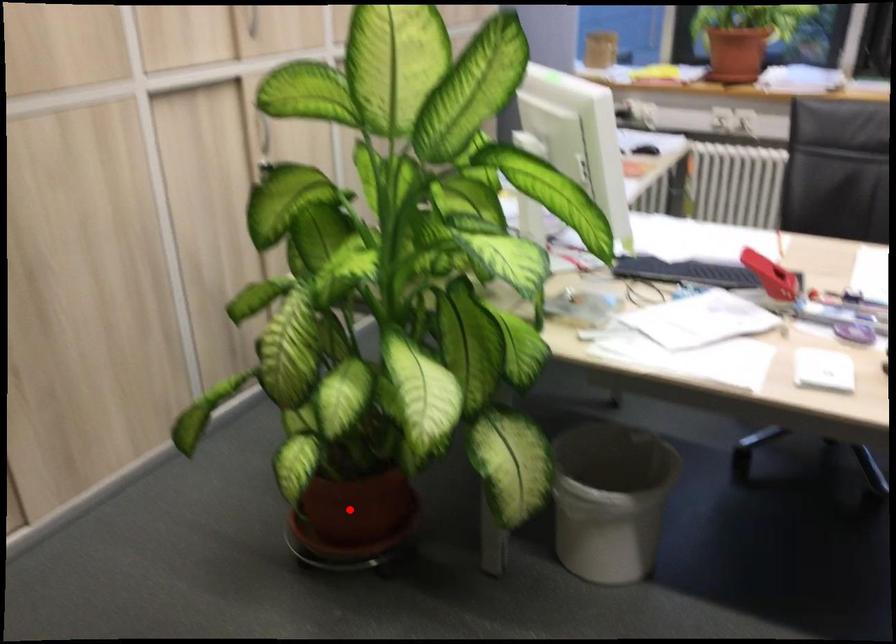
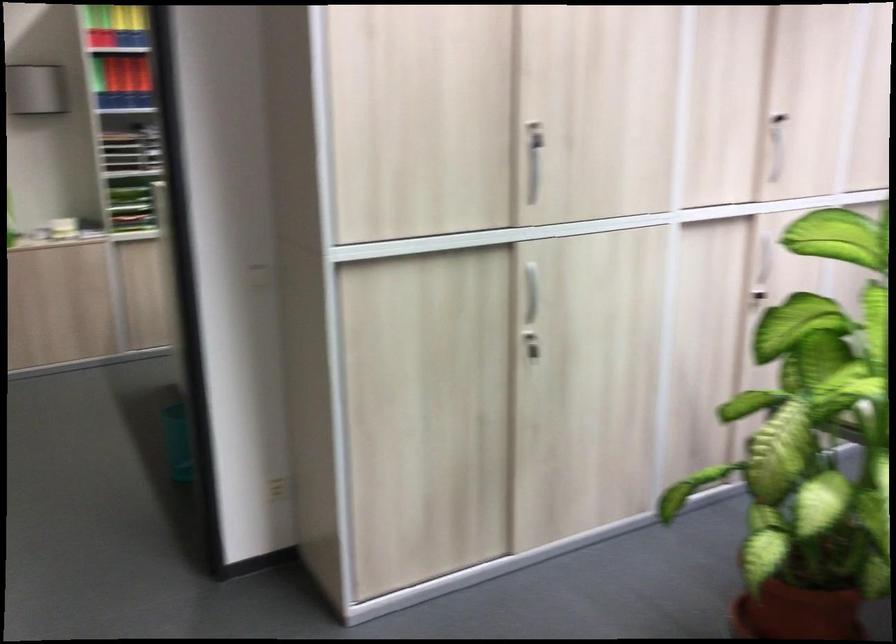
Locate, in the second image, the point that corresponds to the highlighted location in the first image.

(797, 612)